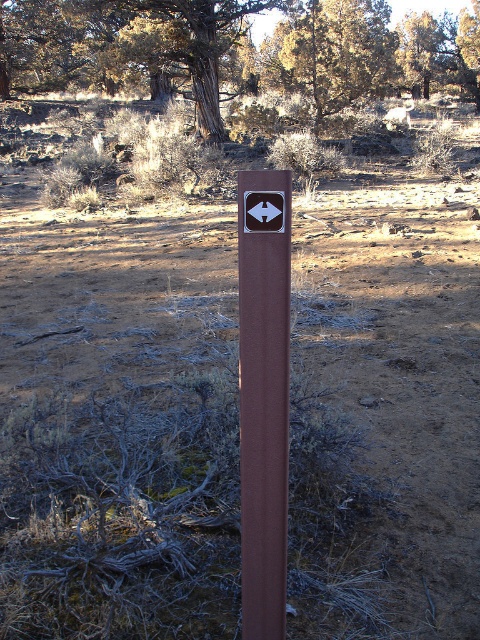
Question: Considering the real-world distances, which object is closest to the brown textured tree at center?

Choices:
 (A) brown polished post at center
 (B) brown dirt field at center

Answer: (A)

Question: Is brown dirt field at center thinner than brown polished post at center?

Choices:
 (A) no
 (B) yes

Answer: (A)

Question: Which point appears closest to the camera in this image?

Choices:
 (A) (283, 586)
 (B) (147, 10)

Answer: (A)

Question: Where is brown dirt field at center located in relation to brown textured tree at center in the image?

Choices:
 (A) below
 (B) above

Answer: (A)

Question: Does brown textured tree at center come in front of brown polished post at center?

Choices:
 (A) no
 (B) yes

Answer: (A)

Question: Based on their relative distances, which object is nearer to the brown textured tree at center?

Choices:
 (A) brown dirt field at center
 (B) brown polished post at center

Answer: (B)